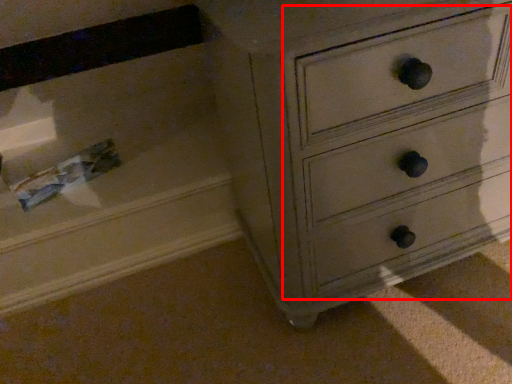
Question: From the image's perspective, where is drawer (annotated by the red box) located relative to drawer?

Choices:
 (A) below
 (B) above

Answer: (B)